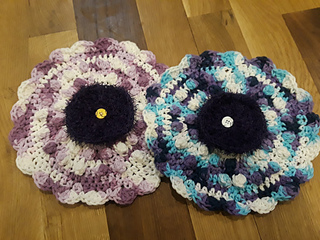
You are a GUI agent. You are given a task and a screenshot of the screen. Output one action in this format:
    pyautogui.click(x=<x>, y=<y>)
    Task: Click on the lighter brown floor
    
    Given the screenshot: What is the action you would take?
    pyautogui.click(x=266, y=20)